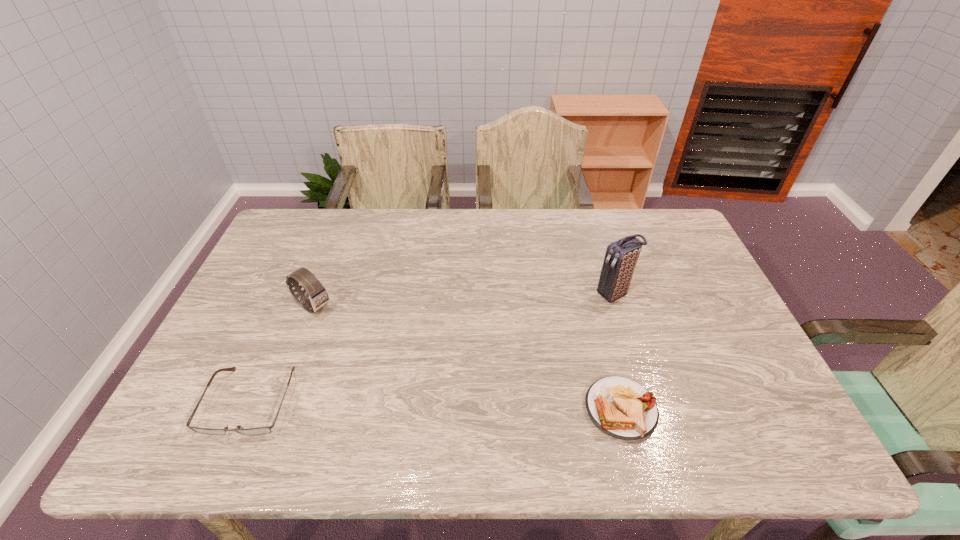
This screenshot has height=540, width=960. In order to click on empty location between the sandwich and the clutch bag in this screenshot , I will do `click(618, 352)`.

Locate an element on the screen. object that is the second closest one to the sandwich is located at coordinates (316, 297).

Where is `object that is the second nearest to the spectacles`? Image resolution: width=960 pixels, height=540 pixels. object that is the second nearest to the spectacles is located at coordinates (620, 407).

Where is `free space that satisfies the following two spatial constraints: 1. on the back side of the sandwich; 2. on the right side of the clutch bag`? free space that satisfies the following two spatial constraints: 1. on the back side of the sandwich; 2. on the right side of the clutch bag is located at coordinates click(591, 294).

Find the location of `vacant space that satisfies the following two spatial constraints: 1. on the back side of the watch; 2. on the left side of the clutch bag`. vacant space that satisfies the following two spatial constraints: 1. on the back side of the watch; 2. on the left side of the clutch bag is located at coordinates (318, 294).